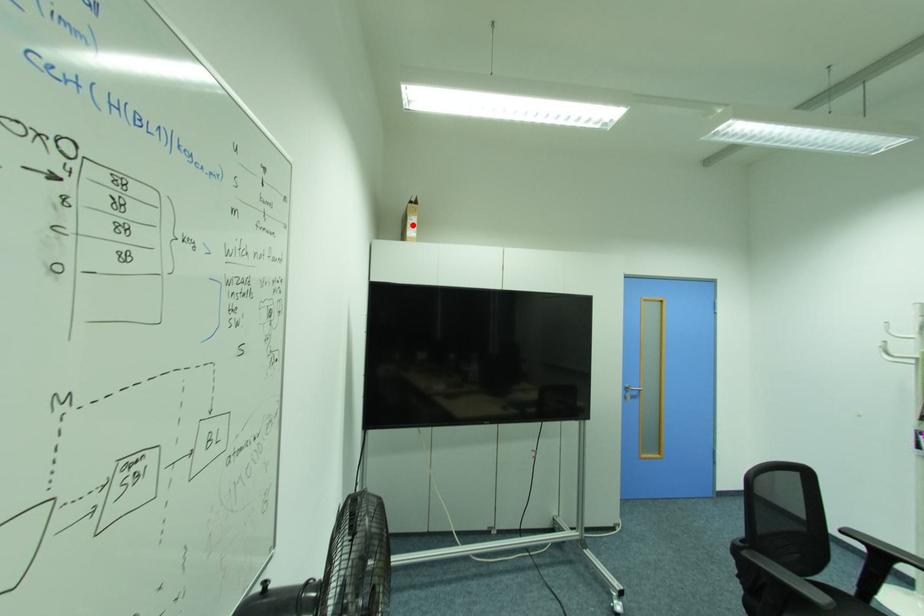
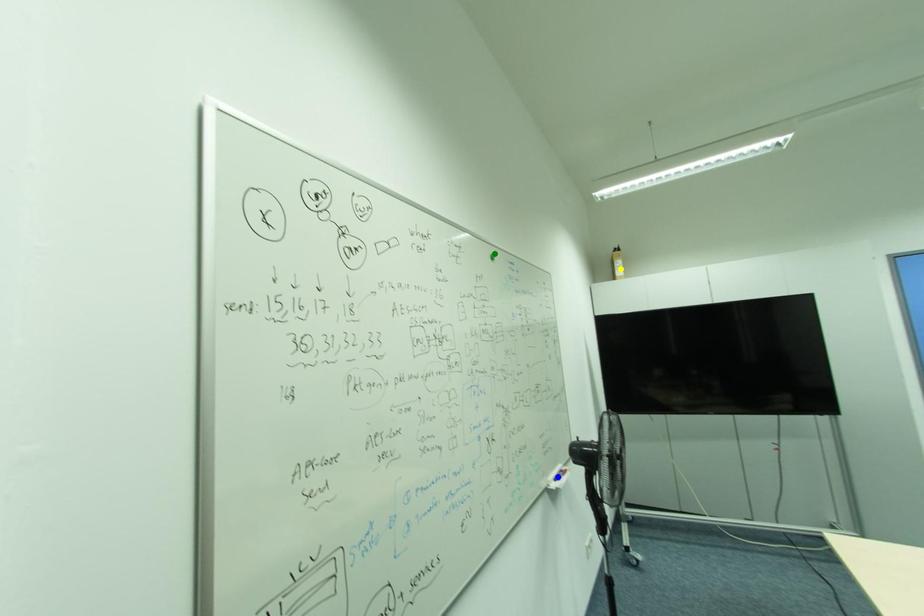
Question: I am providing you with two images of the same scene from different viewpoints. A red point is marked on the first image. You are given multiple points on the second image. In image 2, which mark is for the same physical point as the one in image 1?

Choices:
 (A) yellow point
 (B) green point
 (C) blue point

Answer: (A)